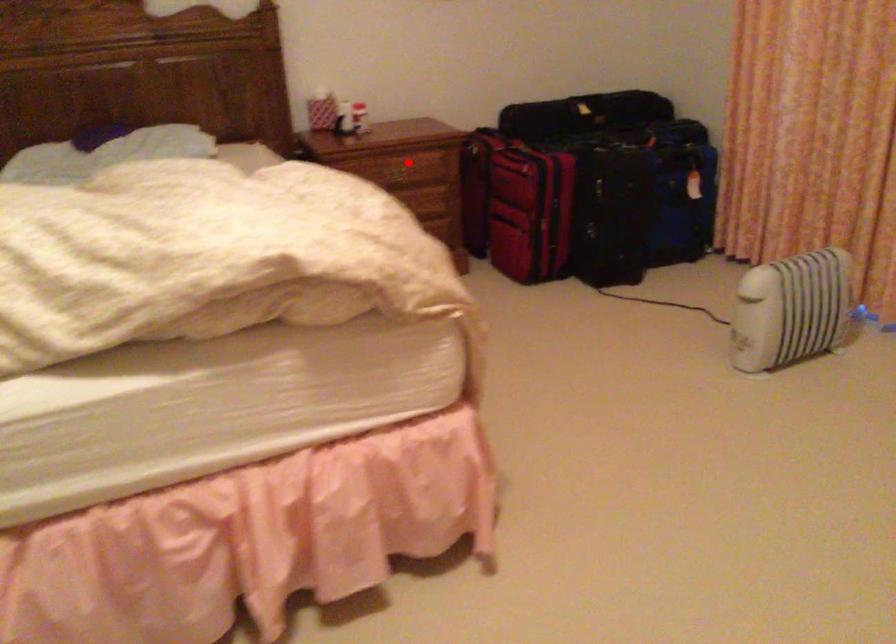
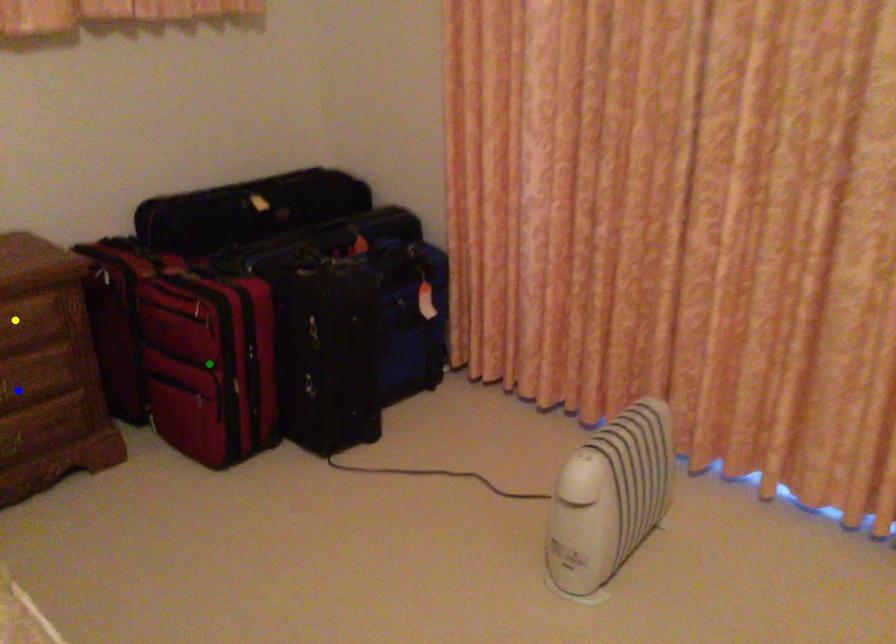
Question: I am providing you with two images of the same scene from different viewpoints. A red point is marked on the first image. You are given multiple points on the second image. Which point in image 2 represents the same 3d spot as the red point in image 1?

Choices:
 (A) blue point
 (B) yellow point
 (C) green point

Answer: (B)